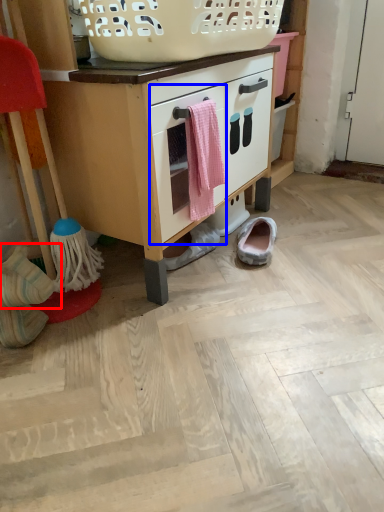
Question: Among these objects, which one is farthest to the camera, footwear (highlighted by a red box) or drawer (highlighted by a blue box)?

Choices:
 (A) footwear
 (B) drawer

Answer: (B)